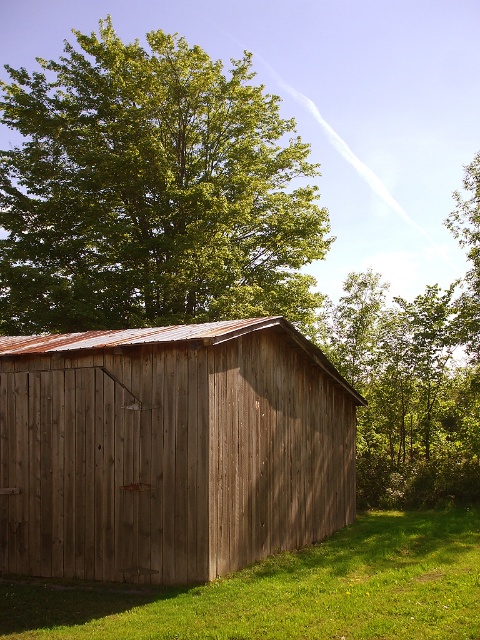
You are standing in front of the shed and want to see the green grass at lower right. Which direction should you look to avoid the green leafy tree at upper left blocking your view?

The green leafy tree at upper left is above the green grass at lower right, so you should look downward to avoid the tree blocking your view.

Based on the scene description, where is the wooden barn at center located in terms of its 2D coordinates?

The wooden barn at center is located at the 2D coordinates of point (170, 449).

You are standing in front of the rustic wooden shed and notice the green leafy tree at upper left and the green grass at lower right. Which of these two objects is bigger in size?

The green leafy tree at upper left is larger in size compared to the green grass at lower right.